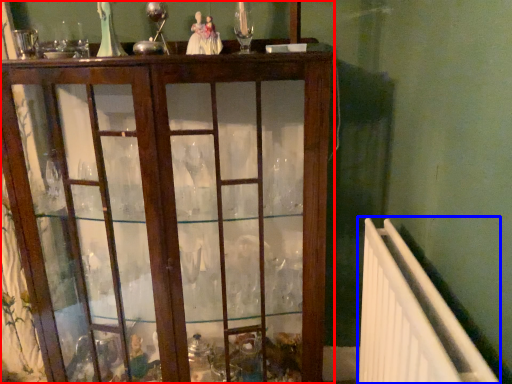
Question: Which object appears farthest to the camera in this image, furniture (highlighted by a red box) or radiator (highlighted by a blue box)?

Choices:
 (A) furniture
 (B) radiator

Answer: (A)